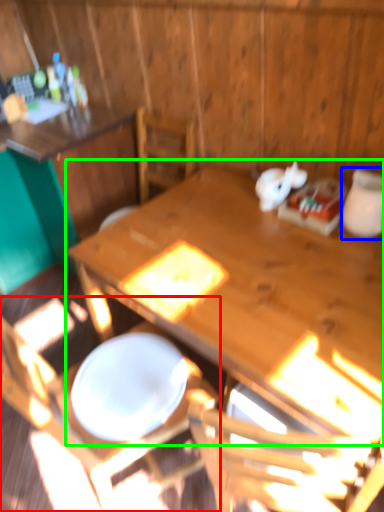
Question: Which object is the closest to the chair (highlighted by a red box)? Choose among these: tableware (highlighted by a blue box) or table (highlighted by a green box).

Choices:
 (A) tableware
 (B) table

Answer: (B)